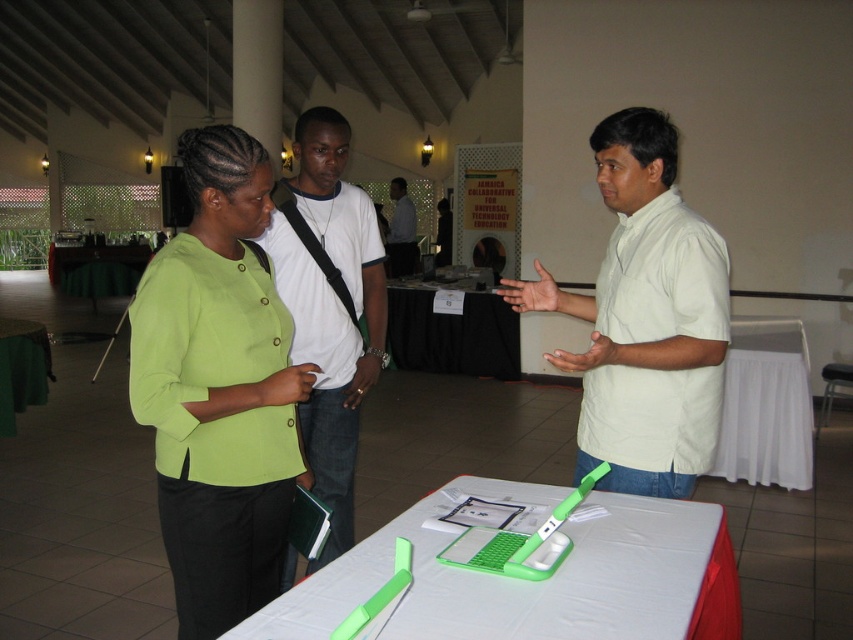
Does white matte shirt at center appear under white cotton t-shirt at center?

No.

In the scene shown: Which is more to the left, white matte shirt at center or white cotton t-shirt at center?

From the viewer's perspective, white cotton t-shirt at center appears more on the left side.

What do you see at coordinates (643, 317) in the screenshot? I see `white matte shirt at center` at bounding box center [643, 317].

The width and height of the screenshot is (853, 640). I want to click on white matte shirt at center, so pos(643,317).

Measure the distance between white cotton t-shirt at center and green plastic laptop at center.

white cotton t-shirt at center is 31.46 inches away from green plastic laptop at center.

Measure the distance between point (364,216) and camera.

Point (364,216) and camera are 2.72 meters apart.

The width and height of the screenshot is (853, 640). I want to click on white cotton t-shirt at center, so click(x=329, y=307).

Where is `white cotton t-shirt at center`? The height and width of the screenshot is (640, 853). white cotton t-shirt at center is located at coordinates (329, 307).

Measure the distance from green plastic table at center to green fabric table at lower left.

3.66 meters

Does green plastic table at center have a greater height compared to green fabric table at lower left?

No, green plastic table at center is not taller than green fabric table at lower left.

Is point (611, 598) in front of point (0, 372)?

Yes, it is in front of point (0, 372).

Locate an element on the screen. The width and height of the screenshot is (853, 640). green plastic table at center is located at coordinates (535, 582).